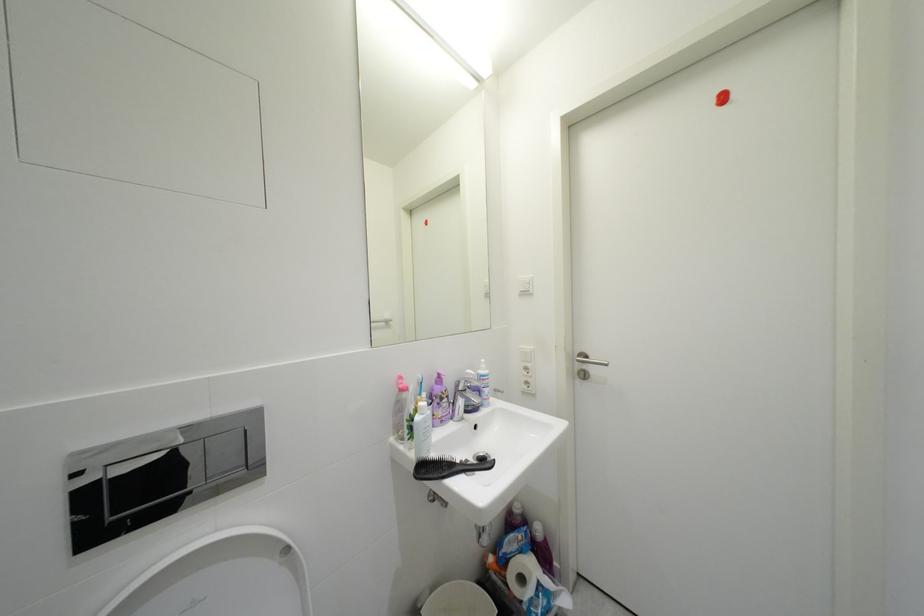
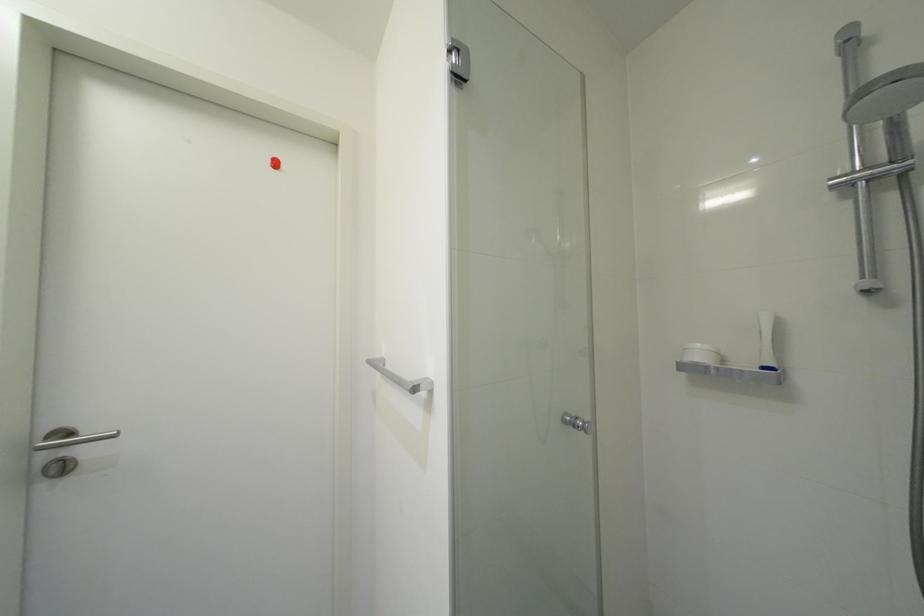
Question: The camera is either moving clockwise (left) or counter-clockwise (right) around the object. The first image is from the beginning of the video and the second image is from the end. Is the camera moving left or right when shooting the video?

Choices:
 (A) Left
 (B) Right

Answer: (A)